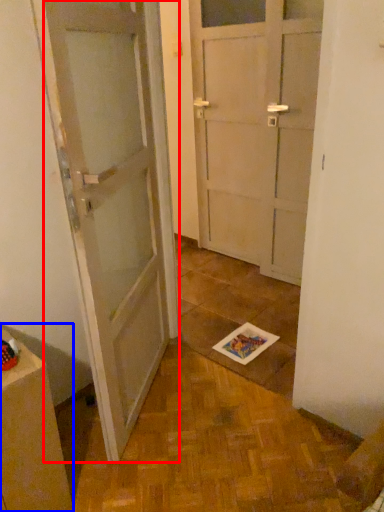
Question: Among these objects, which one is farthest to the camera, door (highlighted by a red box) or cabinetry (highlighted by a blue box)?

Choices:
 (A) door
 (B) cabinetry

Answer: (B)